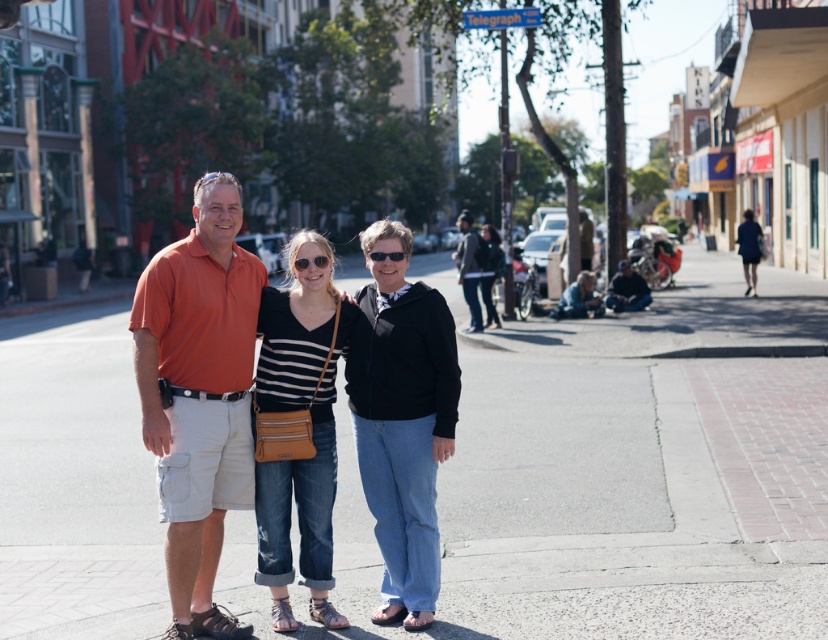
Question: Which point appears farthest from the camera in this image?

Choices:
 (A) (306, 262)
 (B) (485, 276)
 (C) (384, 253)
 (D) (465, 220)

Answer: (D)

Question: Does black matte jacket at center appear under black leather jacket at center?

Choices:
 (A) no
 (B) yes

Answer: (B)

Question: Can you confirm if orange cotton shirt at left is thinner than black matte jacket at center?

Choices:
 (A) no
 (B) yes

Answer: (B)

Question: Which point is farther to the camera?

Choices:
 (A) (487, 324)
 (B) (295, 260)
 (C) (793, 448)
 (D) (400, 259)

Answer: (A)

Question: Considering the relative positions of orange cotton shirt at left and black leather jacket at center in the image provided, where is orange cotton shirt at left located with respect to black leather jacket at center?

Choices:
 (A) above
 (B) below

Answer: (B)

Question: Which point is closer to the camera?

Choices:
 (A) black plastic sunglasses at center
 (B) orange cotton shirt at left

Answer: (B)